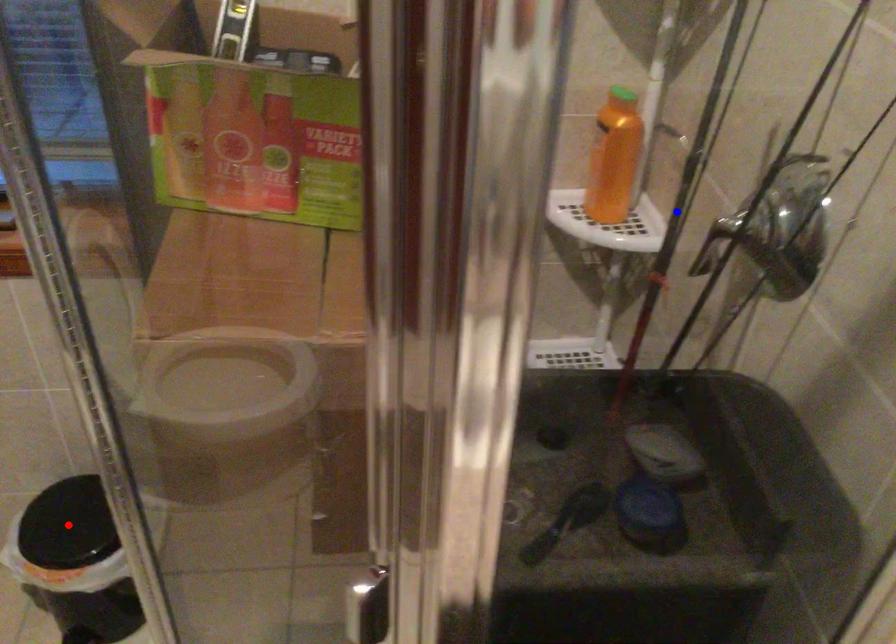
Question: Which of the two points in the image is closer to the camera?

Choices:
 (A) Blue point is closer.
 (B) Red point is closer.

Answer: (A)